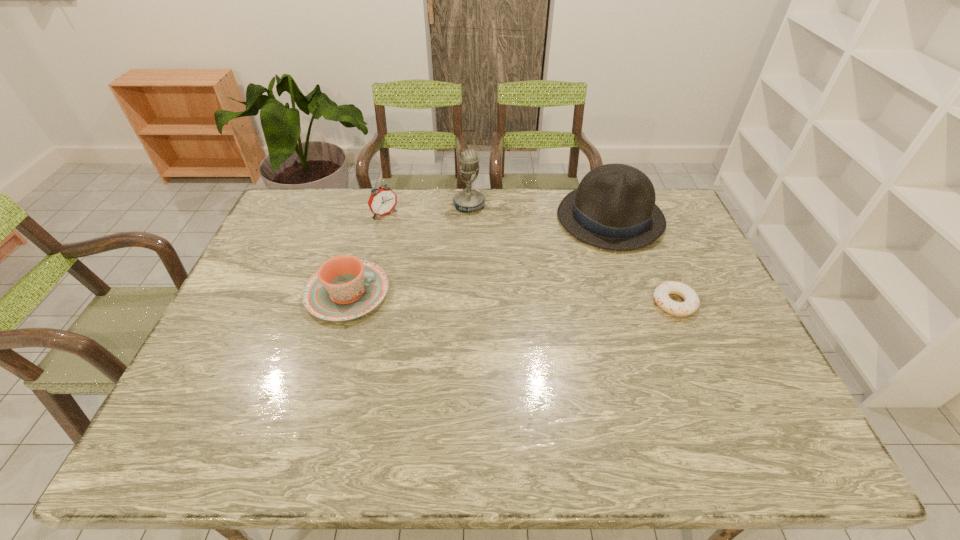
Identify the location of chinaware. This screenshot has width=960, height=540. (345, 287).

This screenshot has width=960, height=540. Identify the location of doughnut. (691, 302).

I want to click on the third shortest object, so click(382, 201).

You are a GUI agent. You are given a task and a screenshot of the screen. Output one action in this format:
    pyautogui.click(x=<x>, y=<y>)
    Task: Click on the bowler hat
    
    Given the screenshot: What is the action you would take?
    pyautogui.click(x=614, y=208)

Where is `the tallest object`? This screenshot has width=960, height=540. the tallest object is located at coordinates (467, 200).

You are a GUI agent. You are given a task and a screenshot of the screen. Output one action in this format:
    pyautogui.click(x=<x>, y=<y>)
    Task: Click on the microphone
    The width and height of the screenshot is (960, 540).
    Given the screenshot: What is the action you would take?
    pyautogui.click(x=467, y=200)

Where is `free location located 0.390m on the handle side of the chinaware`? Image resolution: width=960 pixels, height=540 pixels. free location located 0.390m on the handle side of the chinaware is located at coordinates (523, 293).

This screenshot has height=540, width=960. What are the coordinates of `vacant space located 0.060m on the left of the doughnut` in the screenshot? It's located at (632, 303).

Locate an element on the screen. The width and height of the screenshot is (960, 540). vacant space located 0.220m on the clock face of the alarm clock is located at coordinates tap(425, 254).

I want to click on free point located 0.080m on the clock face of the alarm clock, so [403, 232].